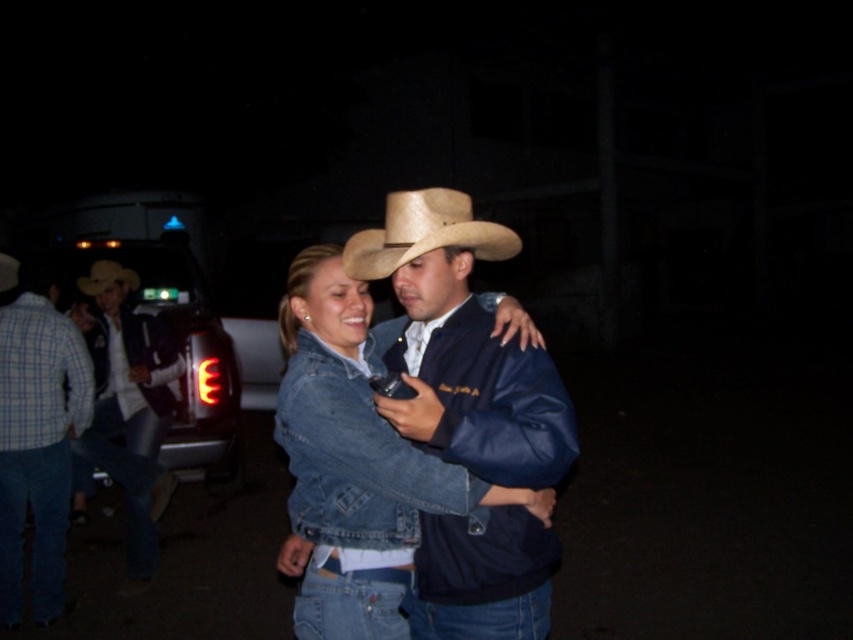
Can you confirm if brushed metal truck at left is positioned to the right of light brown straw cowboy hat at center?

Indeed, brushed metal truck at left is positioned on the right side of light brown straw cowboy hat at center.

Which is in front, point (164, 282) or point (90, 275)?

Point (90, 275)

This screenshot has width=853, height=640. I want to click on brushed metal truck at left, so click(173, 344).

Is brushed metal cowboy hat at left smaller than light brown straw cowboy hat at center?

Incorrect, brushed metal cowboy hat at left is not smaller in size than light brown straw cowboy hat at center.

Does brushed metal cowboy hat at left appear over light brown straw cowboy hat at center?

No, brushed metal cowboy hat at left is not above light brown straw cowboy hat at center.

Where is `brushed metal cowboy hat at left`? Image resolution: width=853 pixels, height=640 pixels. brushed metal cowboy hat at left is located at coordinates pos(131,412).

Is matte blue jacket at center above light brown straw cowboy hat at center?

Actually, matte blue jacket at center is below light brown straw cowboy hat at center.

Can you confirm if matte blue jacket at center is thinner than light brown straw cowboy hat at center?

Incorrect, matte blue jacket at center's width is not less than light brown straw cowboy hat at center's.

Measure the distance between point (428, 369) and camera.

Point (428, 369) is 6.23 feet from camera.

Find the location of a particular element. Image resolution: width=853 pixels, height=640 pixels. matte blue jacket at center is located at coordinates (462, 346).